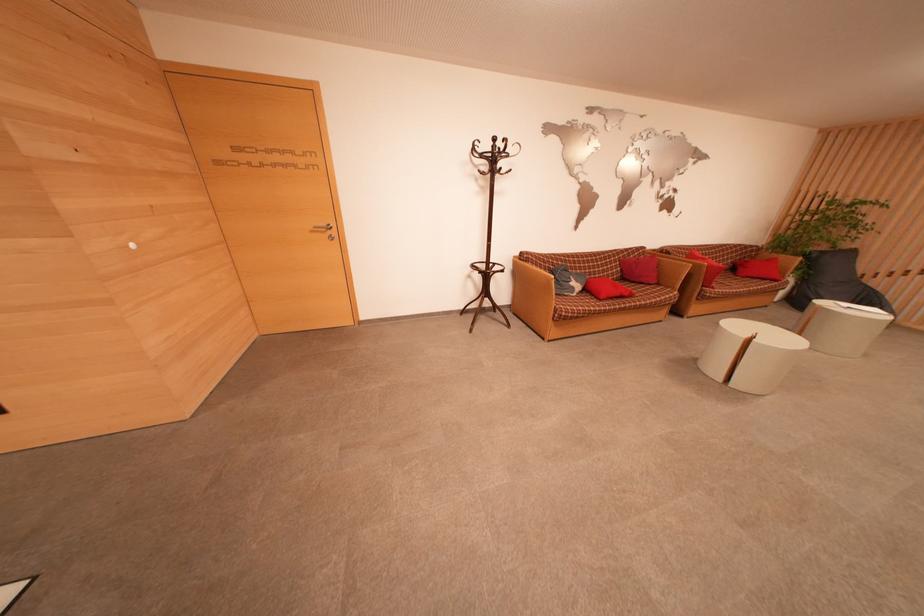
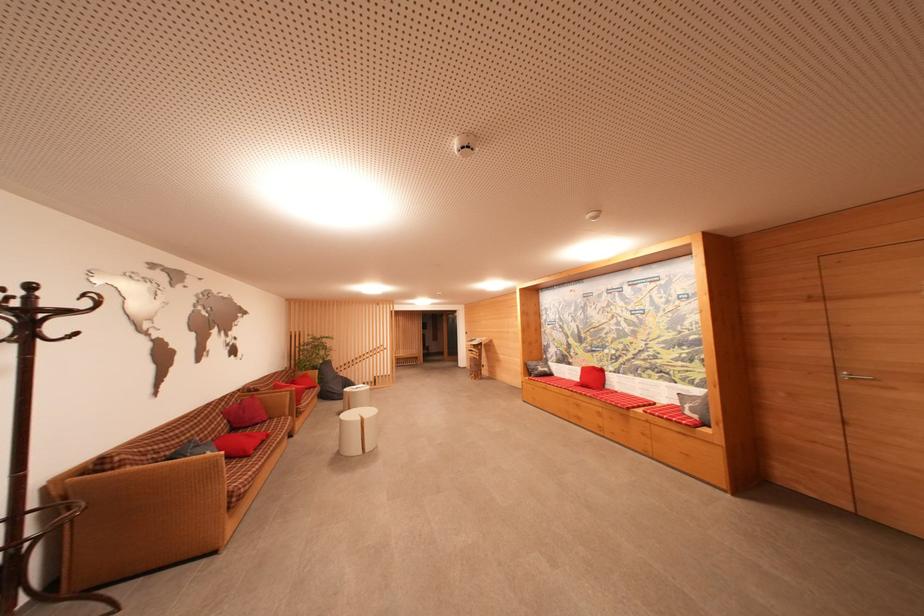
Where in the second image is the point corresponding to pixel 626 265 from the first image?

(231, 416)